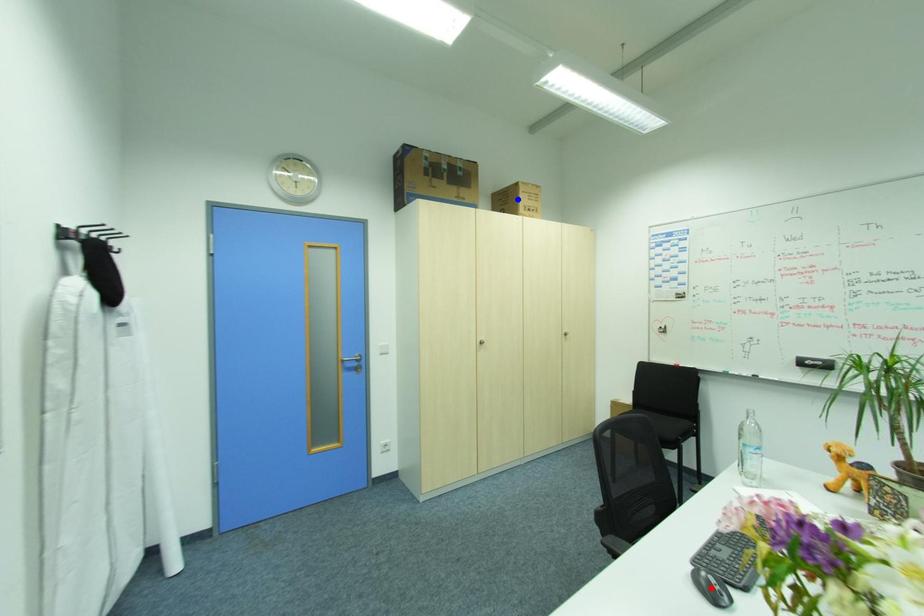
Question: In the image, two points are highlighted. Which point is nearer to the camera? Reply with the corresponding letter.

Choices:
 (A) blue point
 (B) red point

Answer: (B)